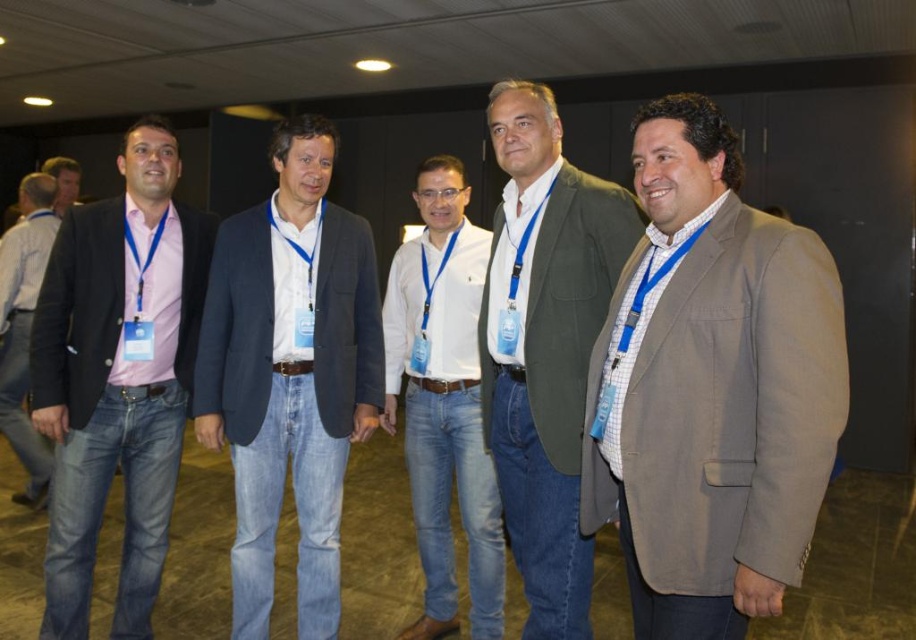
Question: Can you confirm if gray textured blazer at center is thinner than white fabric tie at center?

Choices:
 (A) yes
 (B) no

Answer: (B)

Question: Among these objects, which one is farthest from the camera?

Choices:
 (A) white fabric tie at center
 (B) white glossy shirt at center
 (C) gray textured blazer at center

Answer: (B)

Question: Is gray textured blazer at center smaller than white glossy shirt at center?

Choices:
 (A) yes
 (B) no

Answer: (A)

Question: Which of the following is the closest to the observer?

Choices:
 (A) denim jeans at left
 (B) matte pink shirt at left
 (C) white fabric tie at center

Answer: (C)

Question: Does white glossy shirt at center have a greater width compared to denim jeans at left?

Choices:
 (A) yes
 (B) no

Answer: (B)

Question: Among these points, which one is farthest from the camera?

Choices:
 (A) (x=205, y=337)
 (B) (x=518, y=212)
 (C) (x=169, y=294)
 (D) (x=14, y=289)

Answer: (D)